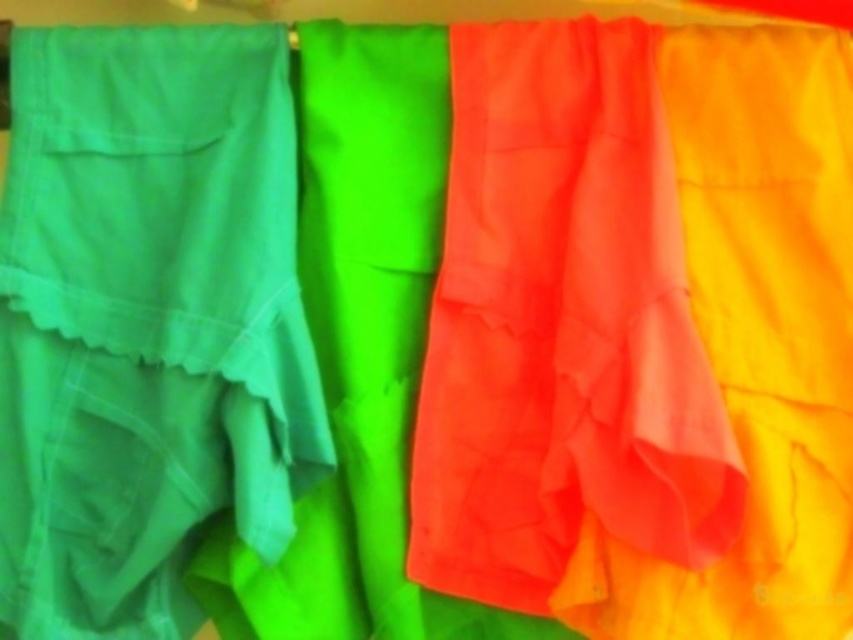
You are an interior designer arranging these fabrics for a photoshoot. You want to ensure that the matte orange fabric at center is visible in the final shot. Given that the matte green skirt at left is currently blocking part of it, what adjustment should you make?

Since the matte orange fabric at center is behind the matte green skirt at left, you should move the matte green skirt at left forward or adjust its position to allow the matte orange fabric at center to be visible.

You are a customer at a fabric store and want to buy a skirt and a fabric for a project. You see the matte green skirt at left and the matte orange fabric at center. Which one is smaller in size?

The matte green skirt at left has a smaller size compared to the matte orange fabric at center, so the matte green skirt at left is smaller.

From the picture: You are an interior designer looking to place a matte green skirt at left and a matte orange fabric at center in a room. Based on the image, which object is located lower in the arrangement?

The matte green skirt at left is positioned under the matte orange fabric at center, so it is located lower in the arrangement.